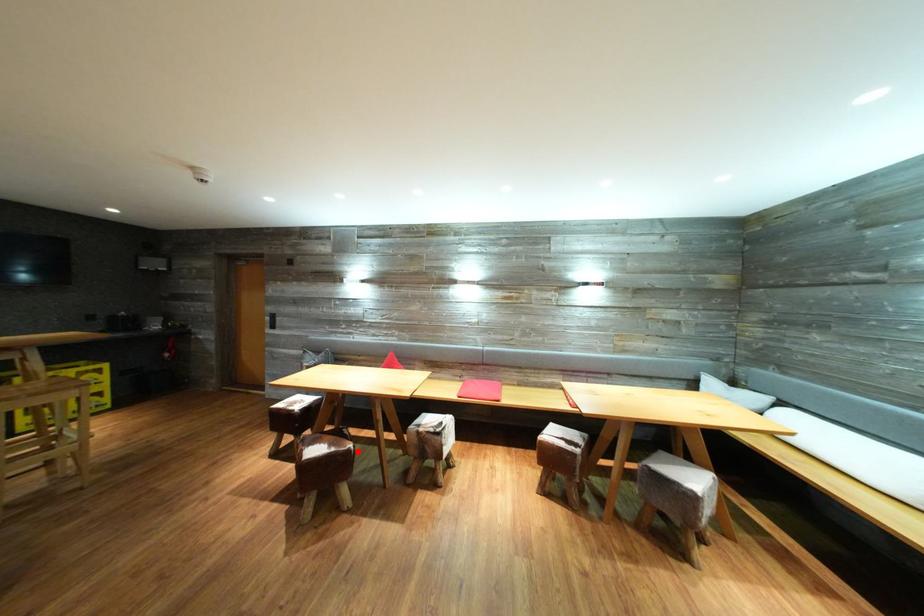
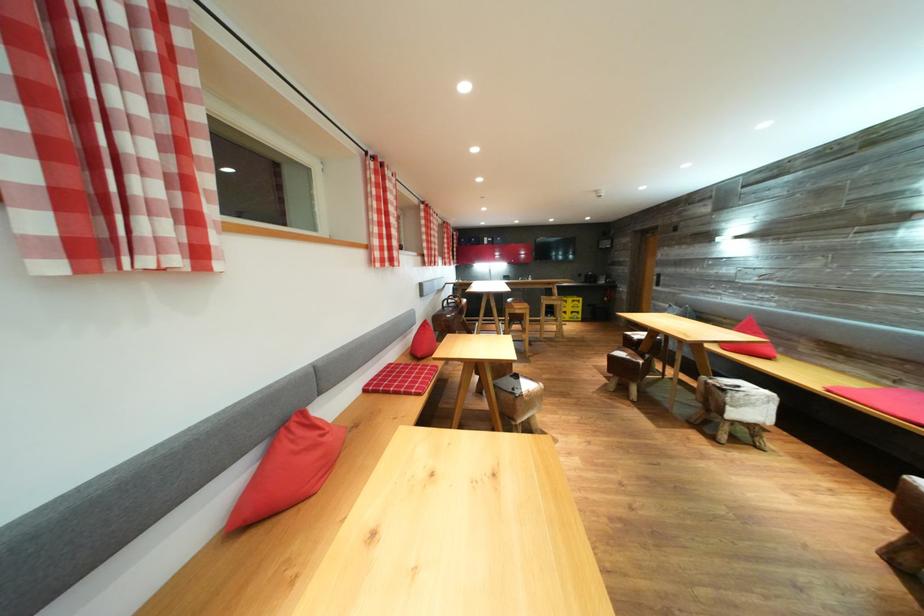
Where in the second image is the point corresponding to the highlighted location from the first image?

(648, 367)